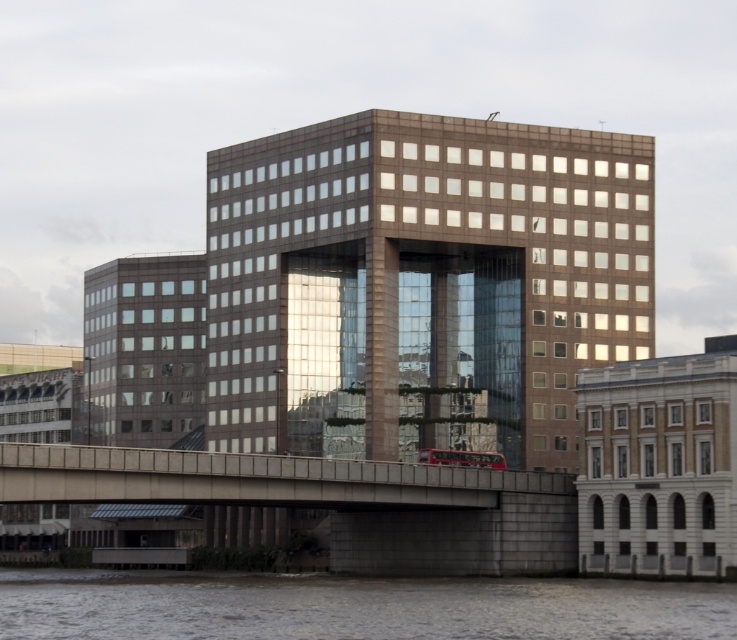
Based on the photo, you are standing in front of the modern architectural scene. You want to take a photo of the brown glass building at center and the brown water at lower center. Which object should you focus on first to ensure it appears larger in your photo?

The brown glass building at center is further to the viewer than brown water at lower center, so focusing on it first will make it appear larger in the photo.